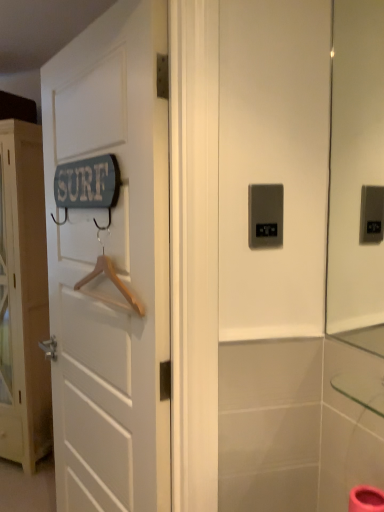
Question: From a real-world perspective, is white wooden door at left, marked as the 1th door in a back-to-front arrangement, above or below wooden hanger at left?

Choices:
 (A) below
 (B) above

Answer: (A)

Question: Is white wooden door at left, positioned as the 2th door in right-to-left order, spatially inside wooden hanger at left, or outside of it?

Choices:
 (A) outside
 (B) inside

Answer: (A)

Question: Considering the real-world distances, which object is farthest from the wooden hanger at left?

Choices:
 (A) white wooden door at left, marked as the 1th door in a back-to-front arrangement
 (B) satin silver panel at center
 (C) white wooden door at left, positioned as the 2th door in back-to-front order

Answer: (A)

Question: Which object is the farthest from the white wooden door at left, the 2th door from the front?

Choices:
 (A) white wooden door at left, acting as the first door starting from the front
 (B) satin silver panel at center
 (C) wooden hanger at left

Answer: (B)